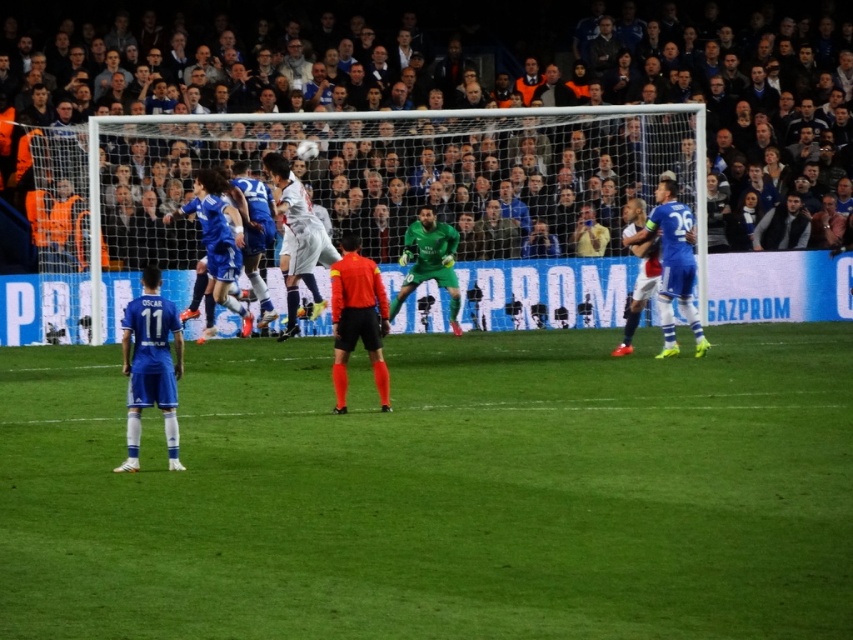
Between green grass football field at center and green matte/goalkeeper at center, which one appears on the left side from the viewer's perspective?

Positioned to the left is green grass football field at center.

Is green grass football field at center thinner than green matte/goalkeeper at center?

No.

Is point (398, 460) positioned after point (410, 259)?

No.

Image resolution: width=853 pixels, height=640 pixels. In order to click on green grass football field at center in this screenshot , I will do `click(438, 492)`.

Who is positioned more to the right, orange jersey at center or green matte/goalkeeper at center?

green matte/goalkeeper at center

Can you confirm if orange jersey at center is taller than green matte/goalkeeper at center?

Incorrect, orange jersey at center's height is not larger of green matte/goalkeeper at center's.

This screenshot has height=640, width=853. What are the coordinates of `orange jersey at center` in the screenshot? It's located at (357, 317).

Find the location of `orange jersey at center`. orange jersey at center is located at coordinates (357, 317).

Is point (125, 360) in front of point (363, 304)?

Yes, it is.

Who is more distant from viewer, [128,440] or [379,388]?

Positioned behind is point [379,388].

Where is `blue jersey at lower left`? The image size is (853, 640). blue jersey at lower left is located at coordinates (149, 365).